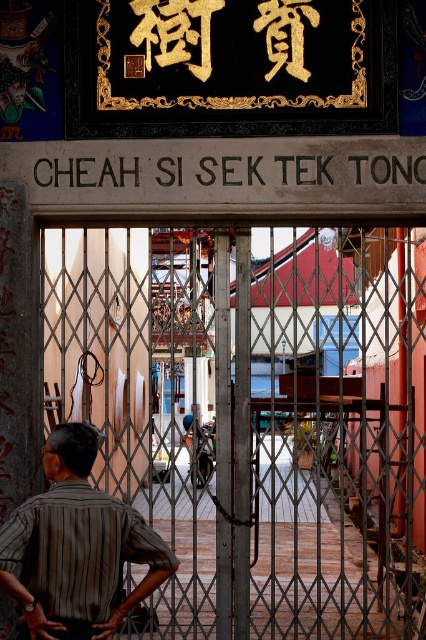
Question: Does metallic gate at center have a larger size compared to brown striped shirt at center?

Choices:
 (A) no
 (B) yes

Answer: (B)

Question: Is metallic gate at center above brown striped shirt at center?

Choices:
 (A) no
 (B) yes

Answer: (B)

Question: Does brown striped shirt at center appear on the left side of black stone sign at center?

Choices:
 (A) yes
 (B) no

Answer: (A)

Question: Which is nearer to the metallic gate at center?

Choices:
 (A) brown striped shirt at center
 (B) black stone sign at center

Answer: (A)

Question: Which object appears closest to the camera in this image?

Choices:
 (A) brown striped shirt at center
 (B) metallic gate at center

Answer: (A)

Question: Which point appears farthest from the camera in this image?

Choices:
 (A) (115, 576)
 (B) (412, 314)

Answer: (B)